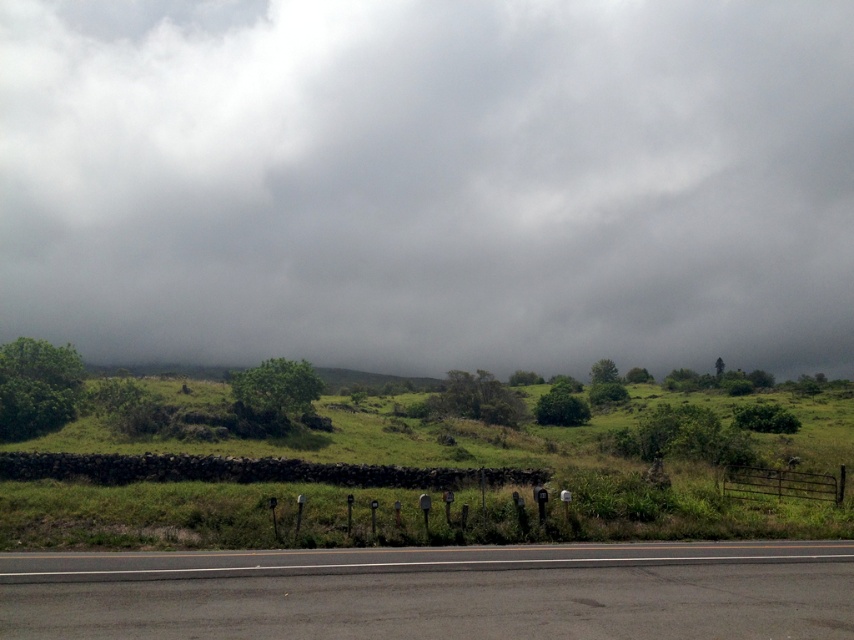
Which is more to the left, gray cloudy sky at upper center or green grassy hillside at center?

gray cloudy sky at upper center is more to the left.

Between point (612, 8) and point (771, 493), which one is positioned in front?

Positioned in front is point (771, 493).

Looking at this image, who is more forward, (x=219, y=317) or (x=232, y=465)?

Point (x=232, y=465) is more forward.

Find the location of a particular element. The width and height of the screenshot is (854, 640). gray cloudy sky at upper center is located at coordinates (430, 182).

Looking at this image, between green grassy hillside at center and black asphalt highway at lower center, which one has more height?

green grassy hillside at center is taller.

Between green grassy hillside at center and black asphalt highway at lower center, which one appears on the left side from the viewer's perspective?

black asphalt highway at lower center is more to the left.

Which is in front, point (151, 534) or point (851, 545)?

Point (851, 545) is in front.

You are a GUI agent. You are given a task and a screenshot of the screen. Output one action in this format:
    pyautogui.click(x=<x>, y=<y>)
    Task: Click on the green grassy hillside at center
    Image resolution: width=854 pixels, height=640 pixels.
    Given the screenshot: What is the action you would take?
    pyautogui.click(x=642, y=470)

Can you confirm if gray cloudy sky at upper center is thinner than black asphalt highway at lower center?

In fact, gray cloudy sky at upper center might be wider than black asphalt highway at lower center.

Describe the element at coordinates (430, 182) in the screenshot. I see `gray cloudy sky at upper center` at that location.

The width and height of the screenshot is (854, 640). Identify the location of gray cloudy sky at upper center. (430, 182).

Find the location of `gray cloudy sky at upper center`. gray cloudy sky at upper center is located at coordinates (430, 182).